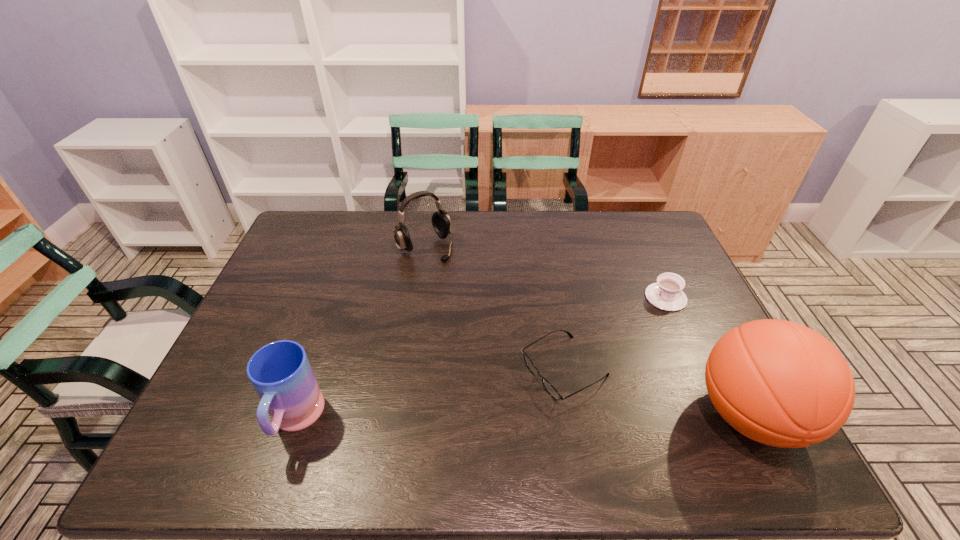
Locate an element on the screen. This screenshot has height=540, width=960. the closest object to the leftmost object is located at coordinates (549, 388).

At what (x,y) coordinates should I click in order to perform the action: click on free location that satisfies the following two spatial constraints: 1. on the back side of the third object from left to right; 2. on the left side of the teacup. Please return your answer as a coordinate pair (x, y). Looking at the image, I should click on (552, 298).

The image size is (960, 540). I want to click on blank space that satisfies the following two spatial constraints: 1. on the front side of the headset; 2. on the left side of the teacup, so click(418, 298).